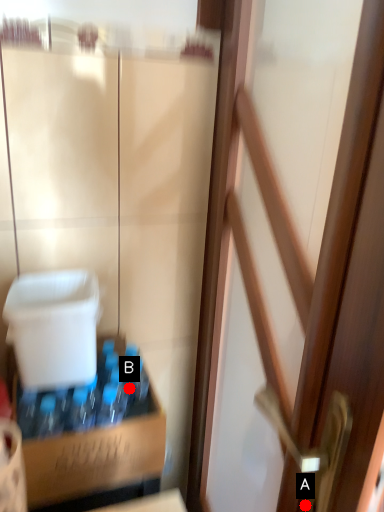
Question: Two points are circled on the image, labeled by A and B beside each circle. Which point is further to the camera?

Choices:
 (A) A is further
 (B) B is further

Answer: (B)